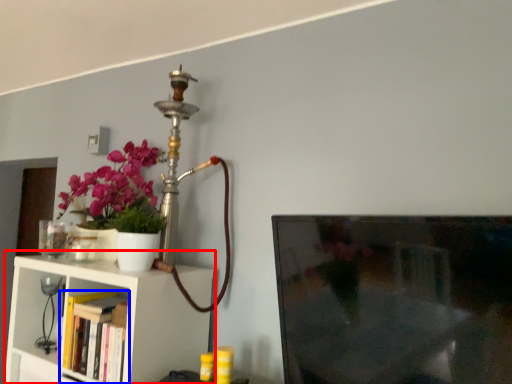
Question: Which object appears closest to the camera in this image, shelf (highlighted by a red box) or book (highlighted by a blue box)?

Choices:
 (A) shelf
 (B) book

Answer: (A)